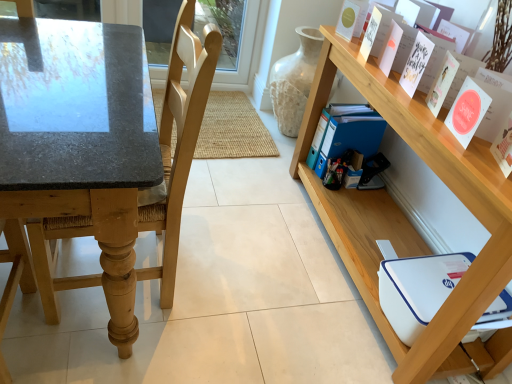
Identify the location of vacant point to the left of white paper at upper right, positioned as the fourth paperback book in back-to-front order. This screenshot has width=512, height=384. (389, 83).